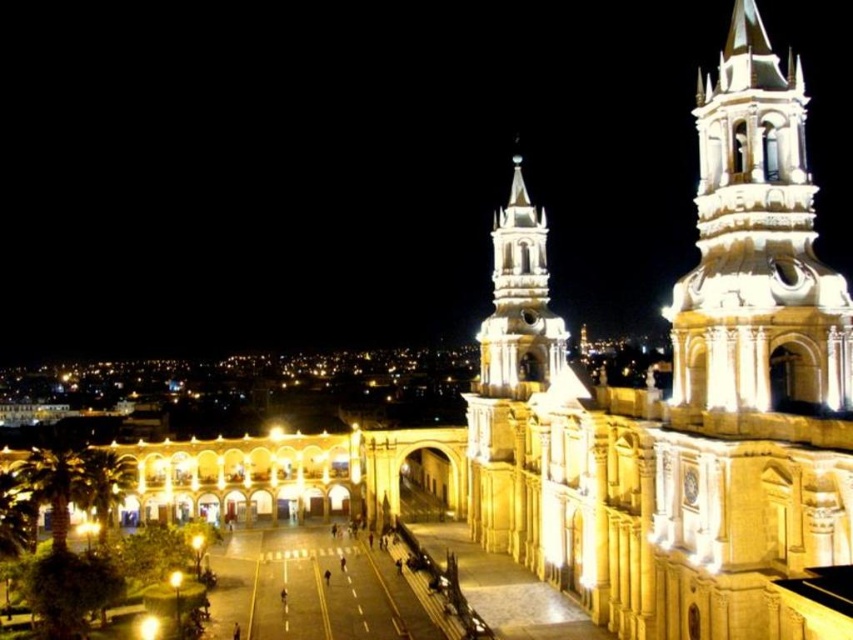
Which is behind, point (715, 269) or point (543, 282)?

The point (543, 282) is behind.

Between white stone tower at upper right and white stone tower at center, which one appears on the left side from the viewer's perspective?

Positioned to the left is white stone tower at center.

Between point (778, 177) and point (500, 262), which one is positioned behind?

Positioned behind is point (500, 262).

The width and height of the screenshot is (853, 640). In order to click on white stone tower at upper right in this screenshot , I will do `click(757, 248)`.